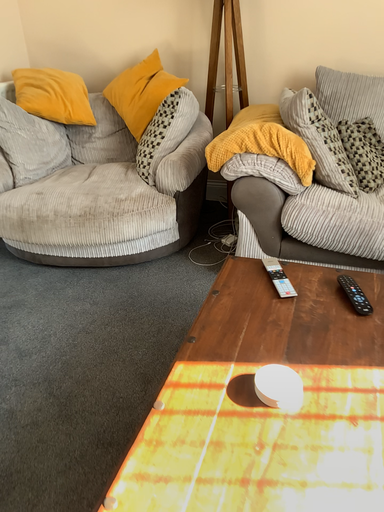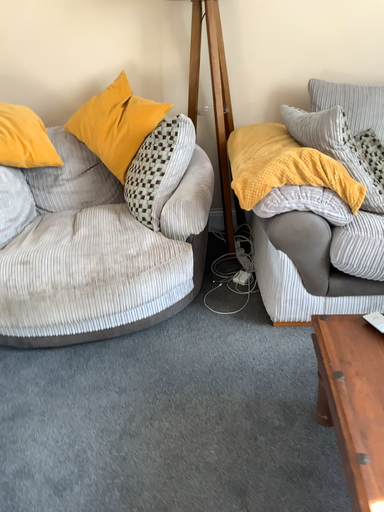
Question: How did the camera likely rotate when shooting the video?

Choices:
 (A) rotated right
 (B) rotated left

Answer: (A)